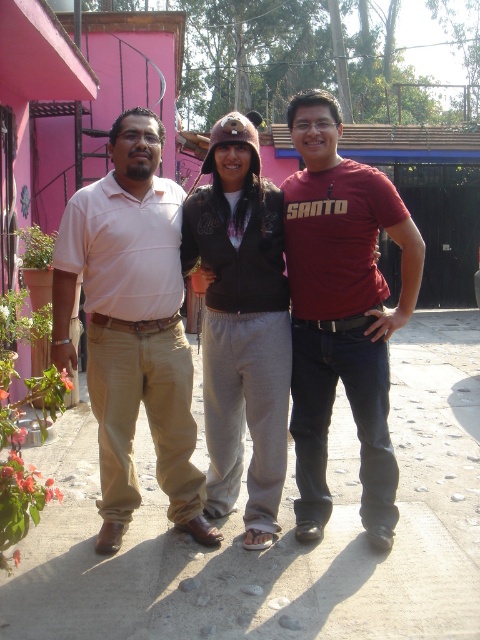
You are a photographer standing in front of the pink building. You notice two people wearing the maroon cotton shirt at center and the matte brown jacket at center. Which one is closer to you?

The maroon cotton shirt at center is closer to you because it is further to the viewer than the matte brown jacket at center.

You are a photographer trying to capture the light brown cotton pants at left and dark brown leather jacket at center in the same frame. Which clothing item is wider in the image?

The light brown cotton pants at left might be wider than dark brown leather jacket at center according to the description.